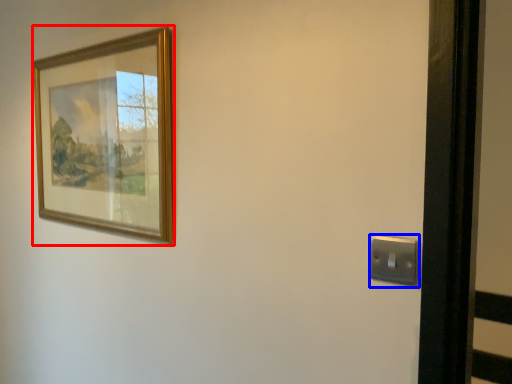
Question: Which of the following is the farthest to the observer, picture frame (highlighted by a red box) or light switch (highlighted by a blue box)?

Choices:
 (A) picture frame
 (B) light switch

Answer: (A)